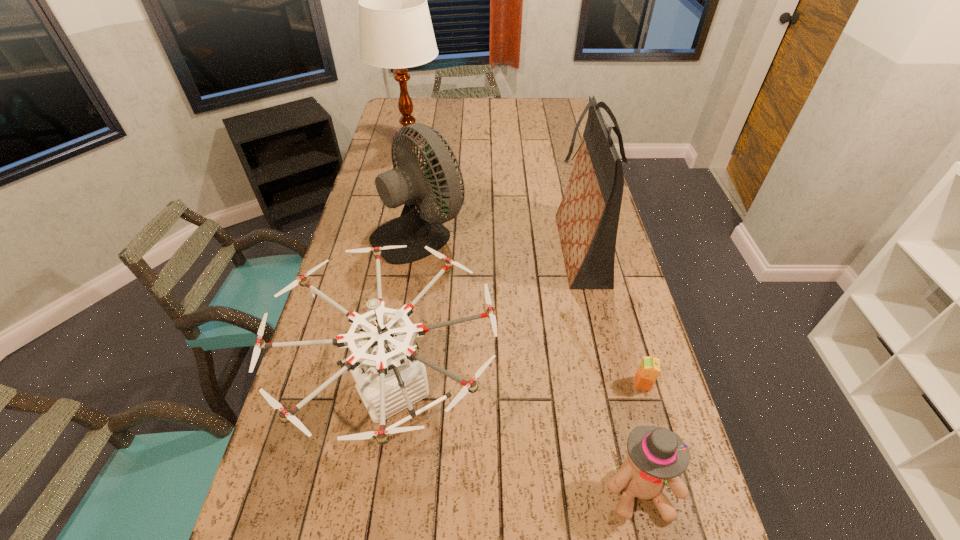
What are the coordinates of `vacant space located in front of the fan to direct airflow` in the screenshot? It's located at (495, 232).

You are a GUI agent. You are given a task and a screenshot of the screen. Output one action in this format:
    pyautogui.click(x=<x>, y=<y>)
    Task: Click on the blank area located on the right of the drone
    
    Given the screenshot: What is the action you would take?
    pyautogui.click(x=541, y=392)

You are a GUI agent. You are given a task and a screenshot of the screen. Output one action in this format:
    pyautogui.click(x=<x>, y=<y>)
    Task: Click on the free space located on the left of the shortest object
    The width and height of the screenshot is (960, 540).
    Given the screenshot: What is the action you would take?
    pyautogui.click(x=591, y=383)

What are the coordinates of `table lamp situated at the left edge` in the screenshot? It's located at click(396, 32).

You are a GUI agent. You are given a task and a screenshot of the screen. Output one action in this format:
    pyautogui.click(x=<x>, y=<y>)
    Task: Click on the fan located in the left edge section of the desktop
    Image resolution: width=960 pixels, height=540 pixels.
    Given the screenshot: What is the action you would take?
    pyautogui.click(x=406, y=184)

Identify the location of drone located at the left edge. (390, 376).

Where is `shopping bag at the right edge`? shopping bag at the right edge is located at coordinates (587, 218).

You are a GUI agent. You are given a task and a screenshot of the screen. Output one action in this format:
    pyautogui.click(x=<x>, y=<y>)
    Task: Click on the rag_doll at the right edge
    This screenshot has width=960, height=540.
    Given the screenshot: What is the action you would take?
    pyautogui.click(x=654, y=454)

Locate an element on the screen. orange juice at the right edge is located at coordinates (649, 369).

Image resolution: width=960 pixels, height=540 pixels. In the image, there is a desktop. Identify the location of vacant space at the far edge. (506, 118).